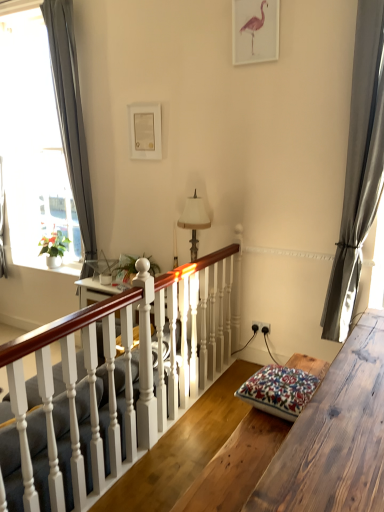
Where is `wooden table at lower right`? wooden table at lower right is located at coordinates (335, 436).

Measure the distance between black plastic power outlet at center-right and camera.

black plastic power outlet at center-right is 10.62 feet away from camera.

This screenshot has height=512, width=384. What do you see at coordinates (262, 326) in the screenshot?
I see `black plastic power outlet at center-right` at bounding box center [262, 326].

What do you see at coordinates (54, 248) in the screenshot? Image resolution: width=384 pixels, height=512 pixels. I see `green matte plant at left` at bounding box center [54, 248].

Identify the location of white painted wood stairs at center. This screenshot has height=512, width=384. [x=111, y=481].

How much space does white matte picture frame at upper center, the second picture frame in the front-to-back sequence, occupy vertically?

The height of white matte picture frame at upper center, the second picture frame in the front-to-back sequence, is 43.21 centimeters.

What do you see at coordinates (145, 131) in the screenshot? The height and width of the screenshot is (512, 384). I see `white matte picture frame at upper center, the second picture frame in the front-to-back sequence` at bounding box center [145, 131].

How much space does satin gray curtain at right, which is counted as the first curtain, starting from the right, occupy horizontally?

satin gray curtain at right, which is counted as the first curtain, starting from the right, is 15.28 centimeters in width.

Locate an element on the screen. The image size is (384, 512). gray fabric curtain at left, which is the 2th curtain from right to left is located at coordinates (70, 113).

Locate an element on the screen. The width and height of the screenshot is (384, 512). wooden table at lower right is located at coordinates (335, 436).

In terms of height, does black plastic power outlet at center-right look taller or shorter compared to matte pink flamingo at upper center, arranged as the first picture frame when viewed from the front?

Considering their sizes, black plastic power outlet at center-right has less height than matte pink flamingo at upper center, arranged as the first picture frame when viewed from the front.

Based on the photo, based on their positions, is black plastic power outlet at center-right located to the left or right of matte pink flamingo at upper center, which is counted as the second picture frame, starting from the bottom?

black plastic power outlet at center-right is positioned on matte pink flamingo at upper center, which is counted as the second picture frame, starting from the bottom,'s right side.

From the image's perspective, would you say black plastic power outlet at center-right is shown under matte pink flamingo at upper center, which is counted as the second picture frame, starting from the bottom?

Yes.

I want to click on picture frame lying in front of the black plastic power outlet at center-right, so click(x=255, y=31).

From the image's perspective, between floral-patterned fabric cushion at lower right and wooden table at lower right, who is located below?

From the image's view, wooden table at lower right is below.

Is floral-patterned fabric cushion at lower right beside wooden table at lower right?

There is a gap between floral-patterned fabric cushion at lower right and wooden table at lower right.

Which object is further away from the camera, floral-patterned fabric cushion at lower right or wooden table at lower right?

floral-patterned fabric cushion at lower right is behind.

Looking at this image, in the image, is white fabric lampshade at center positioned in front of or behind white matte picture frame at upper center, the 1th picture frame ordered from the bottom?

white fabric lampshade at center is in front of white matte picture frame at upper center, the 1th picture frame ordered from the bottom.

Based on the photo, is white fabric lampshade at center surrounding white matte picture frame at upper center, the second picture frame in the front-to-back sequence?

No, white fabric lampshade at center does not contain white matte picture frame at upper center, the second picture frame in the front-to-back sequence.

From their relative heights in the image, would you say white fabric lampshade at center is taller or shorter than white matte picture frame at upper center, which is the 2th picture frame from right to left?

Clearly, white fabric lampshade at center is taller compared to white matte picture frame at upper center, which is the 2th picture frame from right to left.

Is point (191, 204) closer or farther from the camera than point (145, 137)?

Clearly, point (191, 204) is closer to the camera than point (145, 137).

Is gray fabric curtain at left, which is the 2th curtain from right to left, taller than matte pink flamingo at upper center, which is counted as the second picture frame, starting from the bottom?

Correct, gray fabric curtain at left, which is the 2th curtain from right to left, is much taller as matte pink flamingo at upper center, which is counted as the second picture frame, starting from the bottom.

In the image, is gray fabric curtain at left, which appears as the 2th curtain when viewed from the front, positioned in front of or behind matte pink flamingo at upper center, which is counted as the second picture frame, starting from the bottom?

Visually, gray fabric curtain at left, which appears as the 2th curtain when viewed from the front, is located behind matte pink flamingo at upper center, which is counted as the second picture frame, starting from the bottom.

Could matte pink flamingo at upper center, placed as the 2th picture frame when sorted from left to right, be considered to be inside gray fabric curtain at left, which appears as the 2th curtain when viewed from the front?

Definitely not — matte pink flamingo at upper center, placed as the 2th picture frame when sorted from left to right, is not inside gray fabric curtain at left, which appears as the 2th curtain when viewed from the front.

Looking at this image, can you tell me how much gray fabric curtain at left, arranged as the 1th curtain when viewed from the back, and matte pink flamingo at upper center, the 1th picture frame in the top-to-bottom sequence, differ in facing direction?

3.86e-05 degrees.

Who is shorter, gray fabric curtain at left, which appears as the 2th curtain when viewed from the front, or floral-patterned fabric cushion at lower right?

Standing shorter between the two is floral-patterned fabric cushion at lower right.

Looking at this image, from the image's perspective, is gray fabric curtain at left, which appears as the 2th curtain when viewed from the front, located above floral-patterned fabric cushion at lower right?

Yes, from the image's perspective, gray fabric curtain at left, which appears as the 2th curtain when viewed from the front, is over floral-patterned fabric cushion at lower right.

From a real-world perspective, is gray fabric curtain at left, which is the 2th curtain from right to left, positioned under floral-patterned fabric cushion at lower right based on gravity?

Incorrect, from a real-world perspective, gray fabric curtain at left, which is the 2th curtain from right to left, is higher than floral-patterned fabric cushion at lower right.

Is floral-patterned fabric cushion at lower right a part of gray fabric curtain at left, which appears as the 2th curtain when viewed from the front?

Definitely not — floral-patterned fabric cushion at lower right is not inside gray fabric curtain at left, which appears as the 2th curtain when viewed from the front.

Is green matte plant at left not within white matte picture frame at upper center, the second picture frame in the front-to-back sequence?

Yes, green matte plant at left is located beyond the bounds of white matte picture frame at upper center, the second picture frame in the front-to-back sequence.

Consider the image. Which object is further away from the camera taking this photo, green matte plant at left or white matte picture frame at upper center, the 1th picture frame positioned from the back?

green matte plant at left is further from the camera.

Is green matte plant at left to the right of white matte picture frame at upper center, which is counted as the 1th picture frame, starting from the left, from the viewer's perspective?

Incorrect, green matte plant at left is not on the right side of white matte picture frame at upper center, which is counted as the 1th picture frame, starting from the left.

Does white fabric lampshade at center appear on the right side of green matte plant at left?

Indeed, white fabric lampshade at center is positioned on the right side of green matte plant at left.

Which is behind, point (186, 213) or point (57, 254)?

Point (57, 254)

In the scene shown: How different are the orientations of white fabric lampshade at center and green matte plant at left in degrees?

The facing directions of white fabric lampshade at center and green matte plant at left are 0.0122 degrees apart.

The height and width of the screenshot is (512, 384). What are the coordinates of `picture frame that is in front of the black plastic power outlet at center-right` in the screenshot? It's located at (255, 31).

At what (x,y) coordinates should I click in order to perform the action: click on table lying on the right of floral-patterned fabric cushion at lower right. Please return your answer as a coordinate pair (x, y). Image resolution: width=384 pixels, height=512 pixels. Looking at the image, I should click on (335, 436).

Which object lies further to the anchor point white painted wood at center, satin gray curtain at right, which is the second curtain from left to right, or white painted wood stairs at center?

Among the two, satin gray curtain at right, which is the second curtain from left to right, is located further to white painted wood at center.

Looking at the image, which one is located further to white matte picture frame at upper center, marked as the 2th picture frame in a top-to-bottom arrangement, wooden table at lower right or black plastic power outlet at center-right?

wooden table at lower right is positioned further to the anchor white matte picture frame at upper center, marked as the 2th picture frame in a top-to-bottom arrangement.

From the image, which object appears to be nearer to white painted wood stairs at center, floral-patterned fabric cushion at lower right or wooden table at lower right?

Among the two, floral-patterned fabric cushion at lower right is located nearer to white painted wood stairs at center.

Considering their positions, is white painted wood stairs at center positioned closer to floral-patterned fabric cushion at lower right than white painted wood at center?

Based on the image, white painted wood at center appears to be nearer to floral-patterned fabric cushion at lower right.

Looking at the image, which one is located further to floral-patterned fabric cushion at lower right, satin gray curtain at right, which is counted as the first curtain, starting from the front, or matte pink flamingo at upper center, placed as the 2th picture frame when sorted from left to right?

matte pink flamingo at upper center, placed as the 2th picture frame when sorted from left to right.

Considering their positions, is white fabric lampshade at center positioned closer to white matte picture frame at upper center, the second picture frame in the front-to-back sequence, than white painted wood at center?

Based on the image, white fabric lampshade at center appears to be nearer to white matte picture frame at upper center, the second picture frame in the front-to-back sequence.

When comparing their distances from matte pink flamingo at upper center, which is the 2th picture frame from back to front, does floral-patterned fabric cushion at lower right or white fabric lampshade at center seem closer?

white fabric lampshade at center lies closer to matte pink flamingo at upper center, which is the 2th picture frame from back to front, than the other object.

Based on their spatial positions, is floral-patterned fabric cushion at lower right or gray fabric curtain at left, which is counted as the 1th curtain, starting from the left, further from white matte picture frame at upper center, marked as the 2th picture frame in a top-to-bottom arrangement?

floral-patterned fabric cushion at lower right lies further to white matte picture frame at upper center, marked as the 2th picture frame in a top-to-bottom arrangement, than the other object.

Image resolution: width=384 pixels, height=512 pixels. What are the coordinates of `table situated between white painted wood stairs at center and satin gray curtain at right, which is counted as the first curtain, starting from the front, from left to right` in the screenshot? It's located at (335, 436).

At what (x,y) coordinates should I click in order to perform the action: click on curtain between green matte plant at left and satin gray curtain at right, which is counted as the first curtain, starting from the right, in the horizontal direction. Please return your answer as a coordinate pair (x, y). Looking at the image, I should click on (70, 113).

Identify the location of lamp between green matte plant at left and black plastic power outlet at center-right in the horizontal direction. The image size is (384, 512). (194, 220).

At what (x,y) coordinates should I click in order to perform the action: click on pillow between gray fabric curtain at left, which is counted as the 1th curtain, starting from the left, and white painted wood stairs at center, in the vertical direction. Please return your answer as a coordinate pair (x, y). This screenshot has width=384, height=512. Looking at the image, I should click on (279, 391).